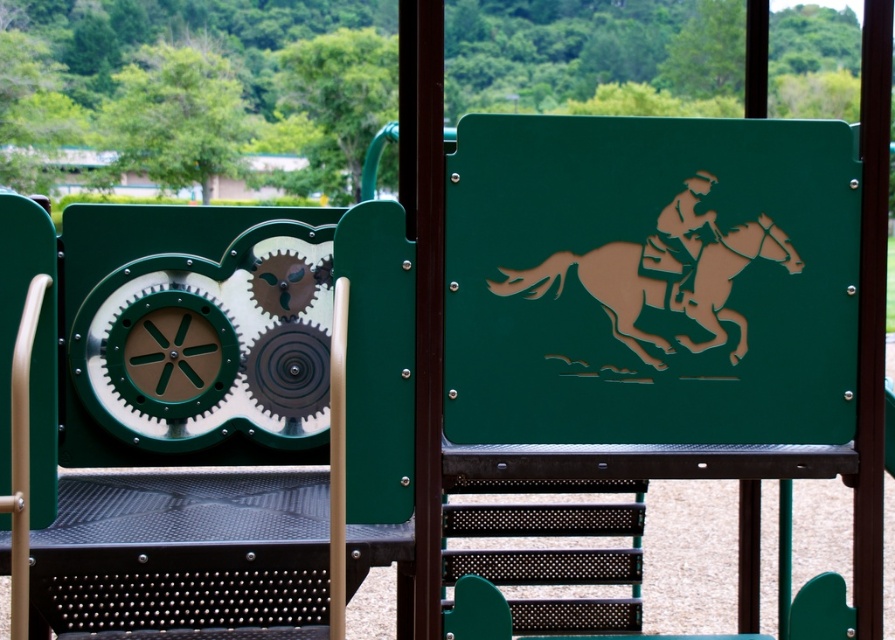
Question: Among these objects, which one is farthest from the camera?

Choices:
 (A) brown laser-cut horse at center
 (B) brown matte/jet black at upper right

Answer: (B)

Question: Is brown laser-cut horse at center to the right of brown matte/jet black at upper right from the viewer's perspective?

Choices:
 (A) yes
 (B) no

Answer: (B)

Question: Which object is farther from the camera taking this photo?

Choices:
 (A) brown laser-cut horse at center
 (B) brown matte/jet black at upper right

Answer: (B)

Question: Can you confirm if brown laser-cut horse at center is thinner than brown matte/jet black at upper right?

Choices:
 (A) no
 (B) yes

Answer: (A)

Question: Observing the image, what is the correct spatial positioning of brown laser-cut horse at center in reference to brown matte/jet black at upper right?

Choices:
 (A) below
 (B) above

Answer: (A)

Question: Which point is farther from the camera taking this photo?

Choices:
 (A) (538, 296)
 (B) (697, 250)

Answer: (B)